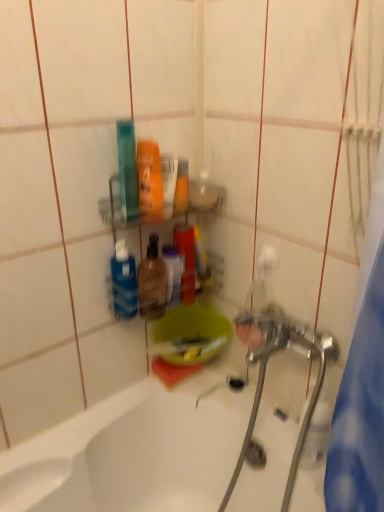
Question: From a real-world perspective, is metallic silver water pipe at lower right over translucent plastic bottle at center?

Choices:
 (A) yes
 (B) no

Answer: (B)

Question: Are metallic silver water pipe at lower right and translucent plastic bottle at center making contact?

Choices:
 (A) yes
 (B) no

Answer: (B)

Question: Does metallic silver water pipe at lower right appear on the right side of translucent plastic bottle at center?

Choices:
 (A) no
 (B) yes

Answer: (B)

Question: Can you confirm if metallic silver water pipe at lower right is smaller than translucent plastic bottle at center?

Choices:
 (A) yes
 (B) no

Answer: (A)

Question: Is metallic silver water pipe at lower right aimed at translucent plastic bottle at center?

Choices:
 (A) yes
 (B) no

Answer: (B)

Question: Would you say chrome metallic faucet at center is inside or outside metallic silver water pipe at lower right?

Choices:
 (A) inside
 (B) outside

Answer: (B)

Question: Considering the relative positions of chrome metallic faucet at center and metallic silver water pipe at lower right in the image provided, is chrome metallic faucet at center to the left or to the right of metallic silver water pipe at lower right?

Choices:
 (A) right
 (B) left

Answer: (B)

Question: Does point (x=281, y=329) appear closer or farther from the camera than point (x=283, y=498)?

Choices:
 (A) farther
 (B) closer

Answer: (A)

Question: From a real-world perspective, is chrome metallic faucet at center above or below metallic silver water pipe at lower right?

Choices:
 (A) above
 (B) below

Answer: (B)

Question: In terms of width, does metallic silver water pipe at lower right look wider or thinner when compared to translucent plastic bottle at center?

Choices:
 (A) thin
 (B) wide

Answer: (A)

Question: From a real-world perspective, relative to translucent plastic bottle at center, is metallic silver water pipe at lower right vertically above or below?

Choices:
 (A) above
 (B) below

Answer: (B)

Question: Looking at the image, does metallic silver water pipe at lower right seem bigger or smaller compared to translucent plastic bottle at center?

Choices:
 (A) big
 (B) small

Answer: (B)

Question: Considering the relative positions of metallic silver water pipe at lower right and translucent plastic bottle at center in the image provided, is metallic silver water pipe at lower right to the left or to the right of translucent plastic bottle at center?

Choices:
 (A) right
 (B) left

Answer: (A)

Question: Considering the positions of translucent plastic bottle at center and metallic silver water pipe at lower right in the image, is translucent plastic bottle at center taller or shorter than metallic silver water pipe at lower right?

Choices:
 (A) tall
 (B) short

Answer: (B)

Question: In the image, is translucent plastic bottle at center on the left side or the right side of metallic silver water pipe at lower right?

Choices:
 (A) right
 (B) left

Answer: (B)